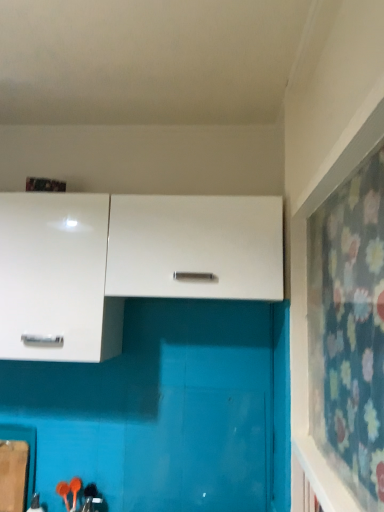
Question: From the image's perspective, is white matte cabinet at center, acting as the 2th cabinetry starting from the left, located above floral fabric curtain at right?

Choices:
 (A) yes
 (B) no

Answer: (A)

Question: Is white matte cabinet at center, acting as the 2th cabinetry starting from the left, smaller than floral fabric curtain at right?

Choices:
 (A) no
 (B) yes

Answer: (A)

Question: From the image's perspective, is white matte cabinet at center, acting as the 2th cabinetry starting from the left, located beneath floral fabric curtain at right?

Choices:
 (A) yes
 (B) no

Answer: (B)

Question: Would you say white matte cabinet at center, acting as the 2th cabinetry starting from the left, is outside floral fabric curtain at right?

Choices:
 (A) no
 (B) yes

Answer: (B)

Question: Can you confirm if white matte cabinet at center, acting as the 2th cabinetry starting from the left, is taller than floral fabric curtain at right?

Choices:
 (A) no
 (B) yes

Answer: (A)

Question: Considering the relative positions of floral fabric curtain at right and white glossy cabinet at upper left, which is the 1th cabinetry in left-to-right order, in the image provided, is floral fabric curtain at right to the left or to the right of white glossy cabinet at upper left, which is the 1th cabinetry in left-to-right order,?

Choices:
 (A) right
 (B) left

Answer: (A)

Question: Considering the positions of floral fabric curtain at right and white glossy cabinet at upper left, which is the 1th cabinetry in left-to-right order, in the image, is floral fabric curtain at right taller or shorter than white glossy cabinet at upper left, which is the 1th cabinetry in left-to-right order,?

Choices:
 (A) tall
 (B) short

Answer: (A)

Question: Is floral fabric curtain at right bigger or smaller than white glossy cabinet at upper left, marked as the second cabinetry in a right-to-left arrangement?

Choices:
 (A) small
 (B) big

Answer: (A)

Question: In the image, is floral fabric curtain at right positioned in front of or behind white glossy cabinet at upper left, which is the 1th cabinetry in left-to-right order?

Choices:
 (A) front
 (B) behind

Answer: (A)

Question: From the image's perspective, is floral fabric curtain at right above or below white matte cabinet at center, acting as the 2th cabinetry starting from the left?

Choices:
 (A) above
 (B) below

Answer: (B)

Question: In the image, is floral fabric curtain at right positioned in front of or behind white matte cabinet at center, acting as the 2th cabinetry starting from the left?

Choices:
 (A) front
 (B) behind

Answer: (A)

Question: From a real-world perspective, is floral fabric curtain at right physically located above or below white matte cabinet at center, placed as the 1th cabinetry when sorted from right to left?

Choices:
 (A) above
 (B) below

Answer: (B)

Question: Is floral fabric curtain at right inside the boundaries of white matte cabinet at center, placed as the 1th cabinetry when sorted from right to left, or outside?

Choices:
 (A) inside
 (B) outside

Answer: (B)

Question: In the image, is white glossy cabinet at upper left, which is the 1th cabinetry in left-to-right order, on the left side or the right side of floral fabric curtain at right?

Choices:
 (A) left
 (B) right

Answer: (A)

Question: Considering the positions of point (110, 314) and point (319, 212), is point (110, 314) closer or farther from the camera than point (319, 212)?

Choices:
 (A) farther
 (B) closer

Answer: (A)